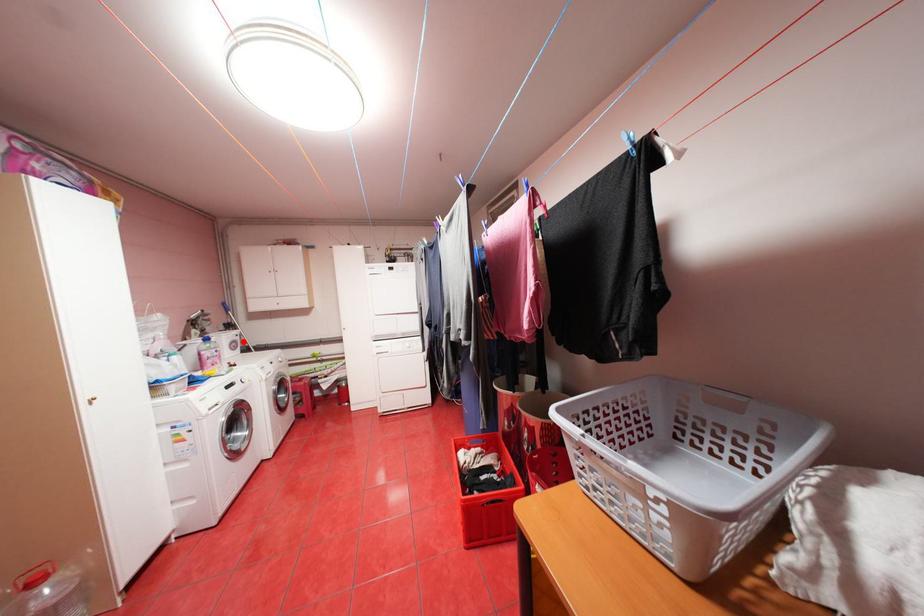
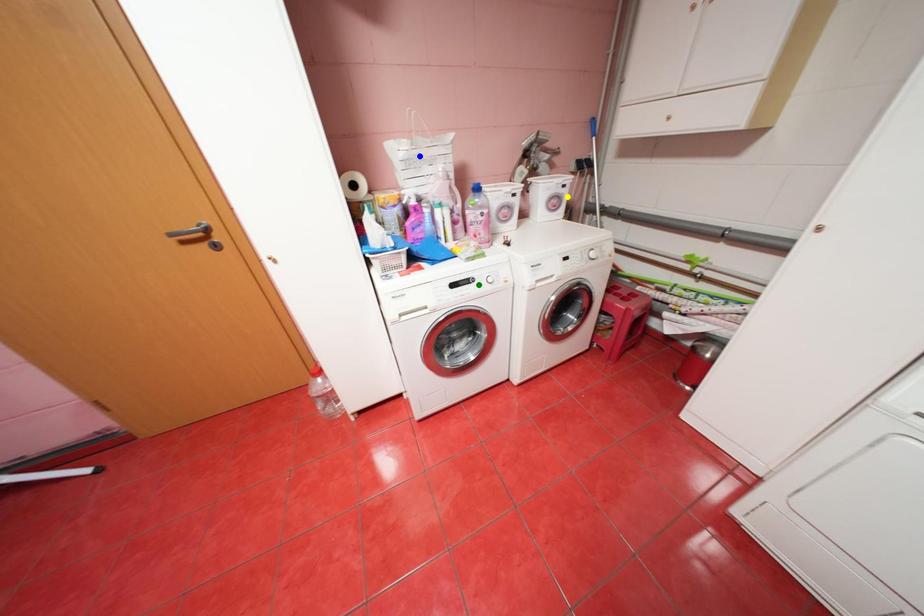
Question: I am providing you with two images of the same scene from different viewpoints. A red point is marked on the first image. You are given multiple points on the second image. Which mark in image 2 goes with the point in image 1?

Choices:
 (A) yellow point
 (B) green point
 (C) blue point

Answer: (A)